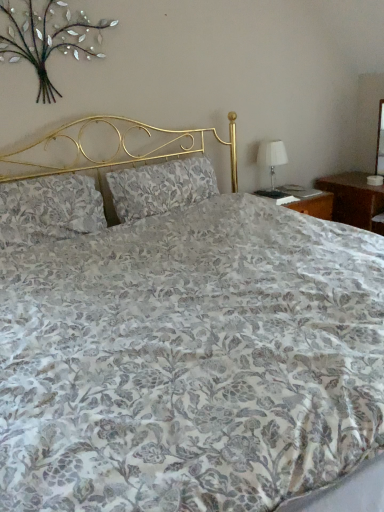
Question: Is white fabric table lamp at right to the right of floral fabric pillow at left, positioned as the second pillow in right-to-left order, from the viewer's perspective?

Choices:
 (A) no
 (B) yes

Answer: (B)

Question: Would you say white fabric table lamp at right is a long distance from floral fabric pillow at left, which is the first pillow in left-to-right order?

Choices:
 (A) no
 (B) yes

Answer: (B)

Question: Can you confirm if white fabric table lamp at right is wider than floral fabric pillow at left, which is the first pillow in left-to-right order?

Choices:
 (A) no
 (B) yes

Answer: (A)

Question: Is white fabric table lamp at right next to floral fabric pillow at left, positioned as the second pillow in right-to-left order?

Choices:
 (A) no
 (B) yes

Answer: (A)

Question: Is white fabric table lamp at right facing towards floral fabric pillow at left, positioned as the second pillow in right-to-left order?

Choices:
 (A) no
 (B) yes

Answer: (A)

Question: Considering the relative positions of white fabric table lamp at right and floral fabric pillow at left, which is the first pillow in left-to-right order, in the image provided, is white fabric table lamp at right to the left of floral fabric pillow at left, which is the first pillow in left-to-right order, from the viewer's perspective?

Choices:
 (A) no
 (B) yes

Answer: (A)

Question: Considering the relative sizes of floral fabric pillow at center, the 1th pillow when ordered from right to left, and floral fabric pillow at left, which is the first pillow in left-to-right order, in the image provided, is floral fabric pillow at center, the 1th pillow when ordered from right to left, thinner than floral fabric pillow at left, which is the first pillow in left-to-right order,?

Choices:
 (A) no
 (B) yes

Answer: (B)

Question: From a real-world perspective, does floral fabric pillow at center, acting as the second pillow starting from the left, sit lower than floral fabric pillow at left, which is the first pillow in left-to-right order?

Choices:
 (A) no
 (B) yes

Answer: (B)

Question: From a real-world perspective, is floral fabric pillow at center, acting as the second pillow starting from the left, physically above floral fabric pillow at left, positioned as the second pillow in right-to-left order?

Choices:
 (A) yes
 (B) no

Answer: (B)

Question: From the image's perspective, is floral fabric pillow at center, acting as the second pillow starting from the left, located above floral fabric pillow at left, positioned as the second pillow in right-to-left order?

Choices:
 (A) yes
 (B) no

Answer: (A)

Question: Is the position of floral fabric pillow at center, acting as the second pillow starting from the left, less distant than that of floral fabric pillow at left, which is the first pillow in left-to-right order?

Choices:
 (A) no
 (B) yes

Answer: (A)

Question: Does floral fabric pillow at center, acting as the second pillow starting from the left, have a lesser height compared to floral fabric pillow at left, which is the first pillow in left-to-right order?

Choices:
 (A) yes
 (B) no

Answer: (A)

Question: Does white fabric table lamp at right turn towards metallic silver floral arrangement at upper left?

Choices:
 (A) no
 (B) yes

Answer: (A)